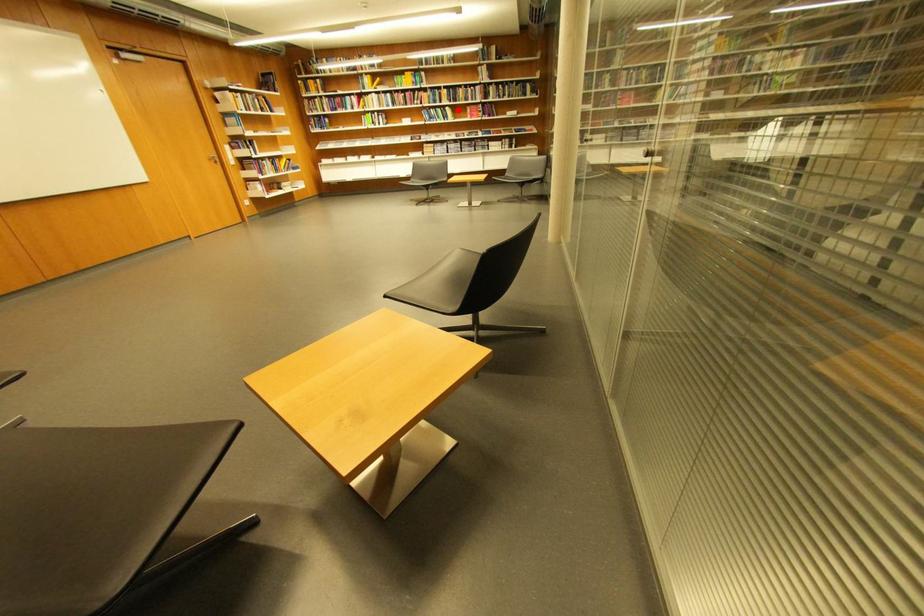
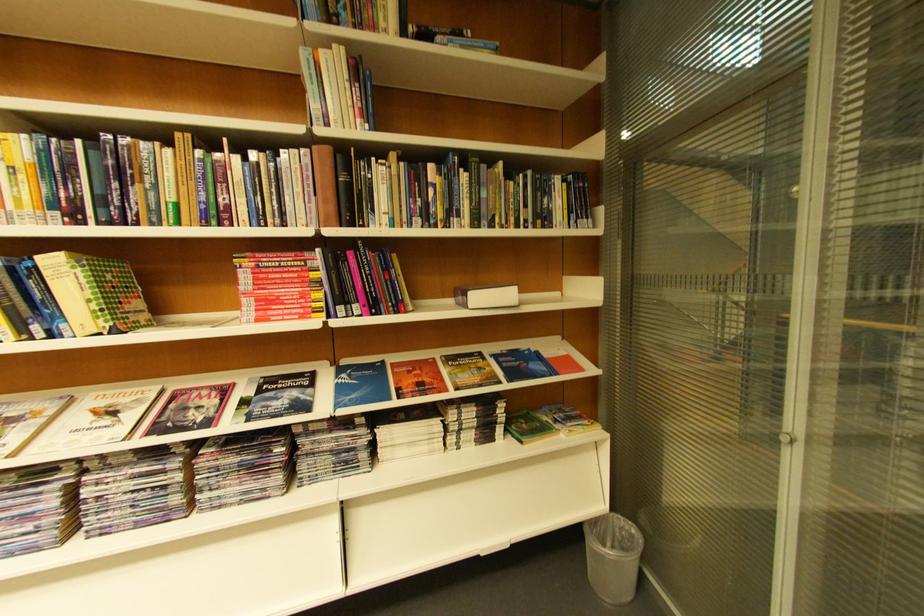
Locate, in the second image, the point that corresponds to the highlighted location in the first image.

(63, 264)